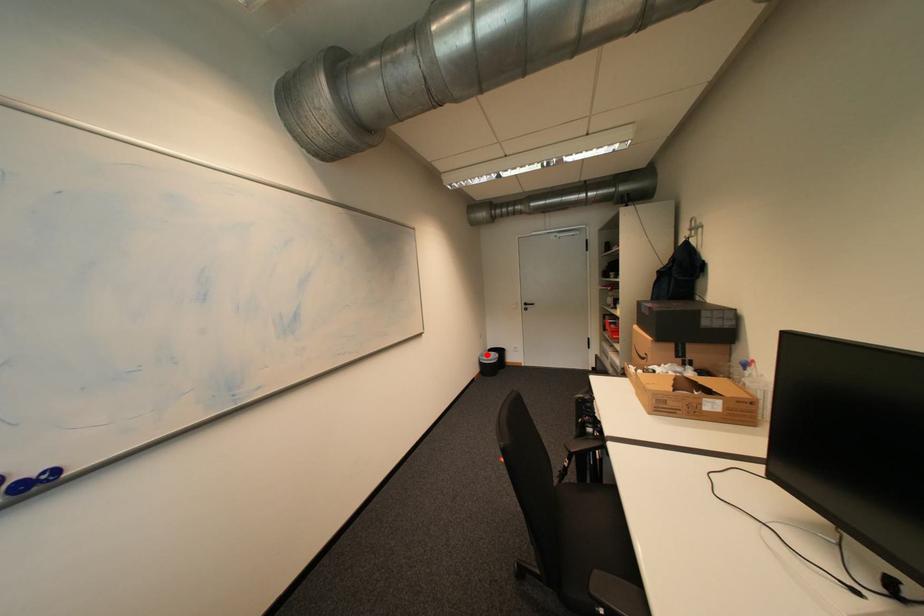
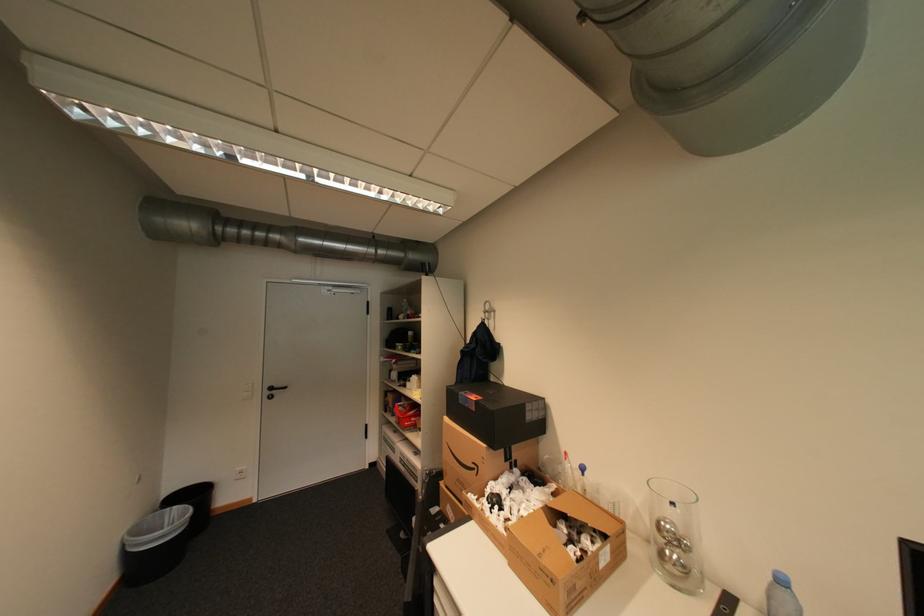
Question: I am providing you with two images of the same scene from different viewpoints. Image1 has a red point marked. In image2, the corresponding 3D location appears at what relative position? Reply with the corresponding letter.

Choices:
 (A) Closer
 (B) Farther

Answer: (A)